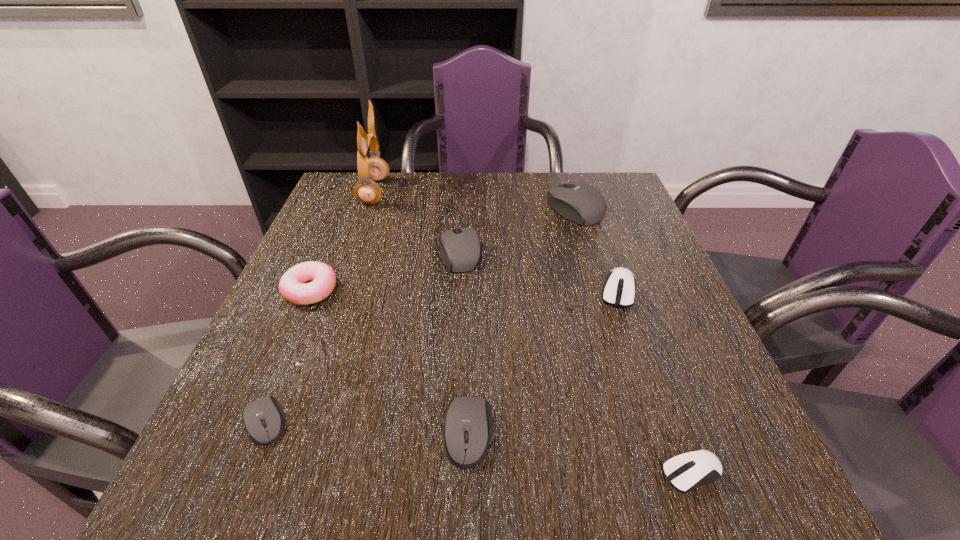
Locate an element on the screen. The width and height of the screenshot is (960, 540). vacant space at the right edge of the desktop is located at coordinates (631, 247).

Where is `vacant space at the far left corner of the desktop`? vacant space at the far left corner of the desktop is located at coordinates (383, 208).

What are the coordinates of `free space at the near left corner of the desktop` in the screenshot? It's located at (301, 470).

Locate an element on the screen. vacant position at the far right corner of the desktop is located at coordinates (617, 200).

Where is `vacant region at the near right corner of the desktop`? The image size is (960, 540). vacant region at the near right corner of the desktop is located at coordinates (687, 509).

Find the location of a particular element. The width and height of the screenshot is (960, 540). free spot between the smallest black computer equipment and the tallest object is located at coordinates (321, 307).

Locate an element on the screen. This screenshot has width=960, height=540. free space between the second farthest black computer equipment and the farthest black computer equipment is located at coordinates (517, 231).

You are a GUI agent. You are given a task and a screenshot of the screen. Output one action in this format:
    pyautogui.click(x=<x>, y=<y>)
    Task: Click on the vacant area that lies between the earphone and the second farthest black computer equipment
    
    Given the screenshot: What is the action you would take?
    pyautogui.click(x=418, y=222)

In order to click on vacant point located between the second farthest black computer equipment and the tallest object in this screenshot , I will do `click(418, 222)`.

Where is `vacant region between the third smallest black computer equipment and the pink doughnut`? vacant region between the third smallest black computer equipment and the pink doughnut is located at coordinates (386, 271).